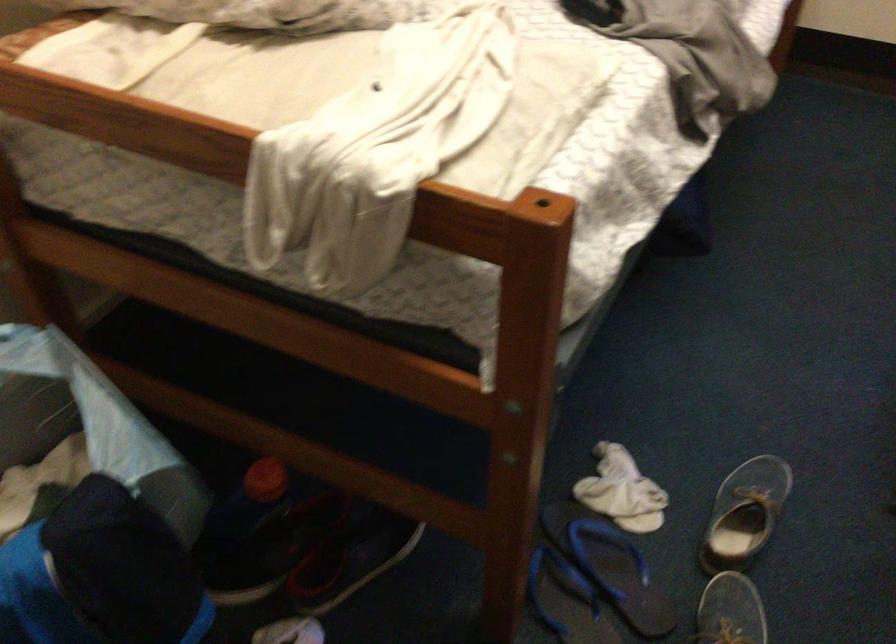
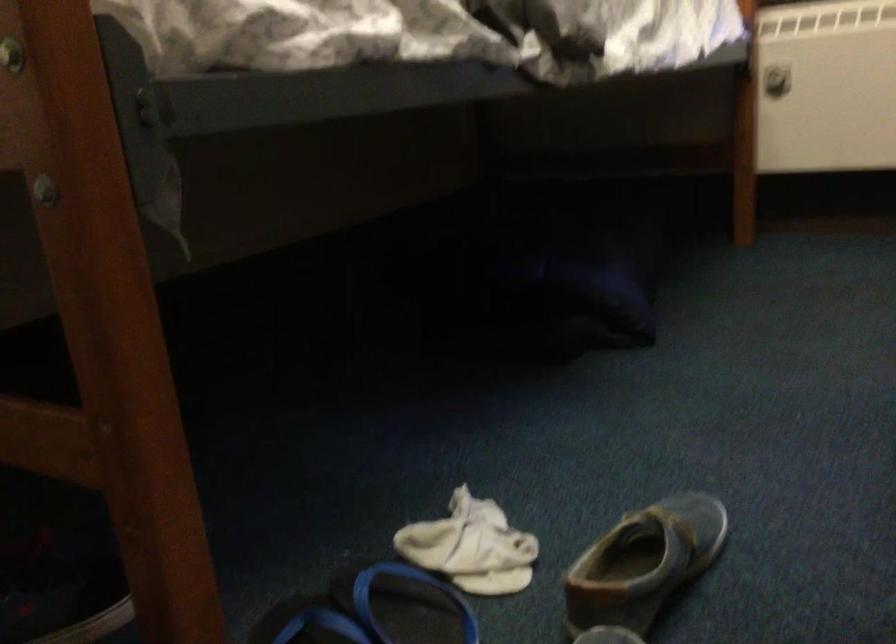
Which direction would the cameraman need to move to produce the second image?

The cameraman moved toward right, forward.